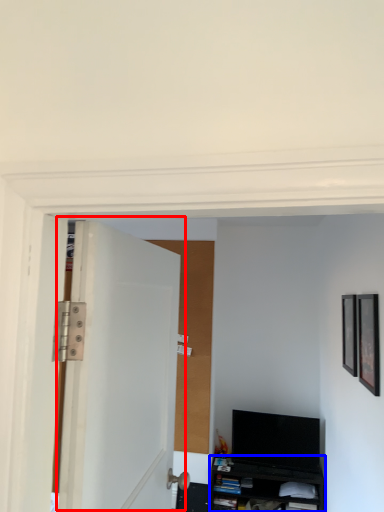
Question: Which object is further to the camera taking this photo, door (highlighted by a red box) or cabinetry (highlighted by a blue box)?

Choices:
 (A) door
 (B) cabinetry

Answer: (B)